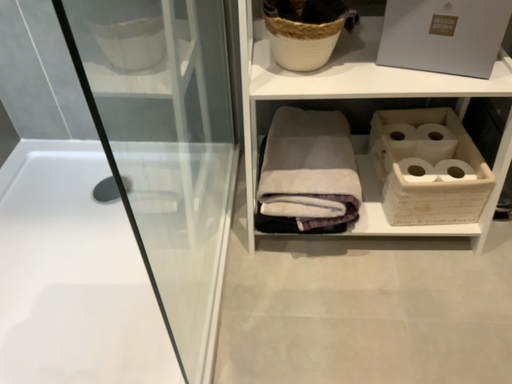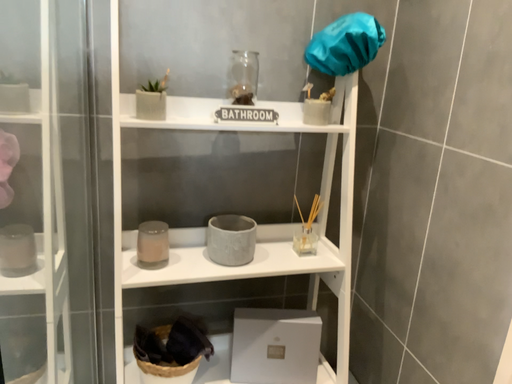
Question: Which way did the camera rotate in the video?

Choices:
 (A) rotated left
 (B) rotated right

Answer: (B)